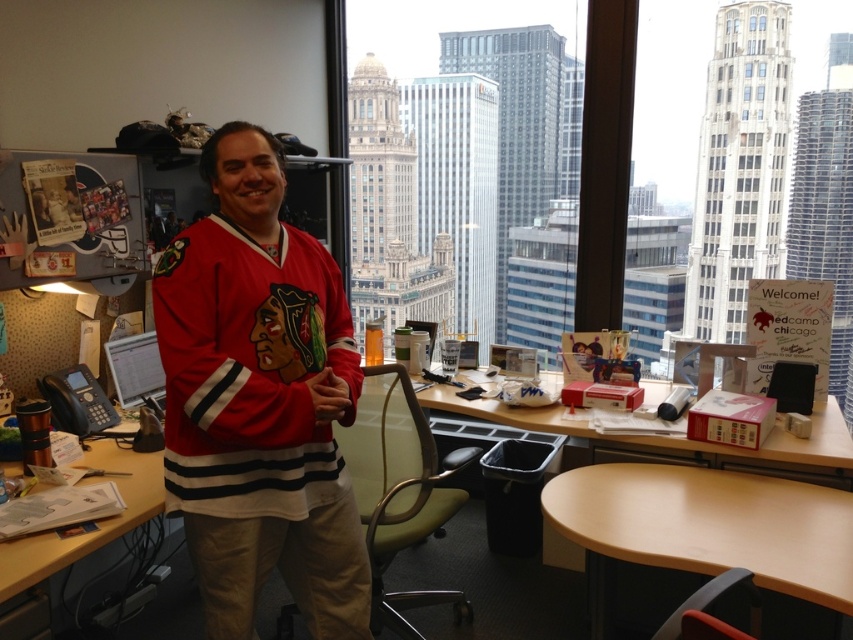
Question: Based on their relative distances, which object is farther from the wooden desk at center?

Choices:
 (A) matte jersey at center
 (B) light brown wood table at lower right

Answer: (A)

Question: Observing the image, what is the correct spatial positioning of matte jersey at center in reference to light brown wood table at lower right?

Choices:
 (A) right
 (B) left

Answer: (B)

Question: Which is nearer to the matte jersey at center?

Choices:
 (A) wooden desk at center
 (B) wooden desk at lower left

Answer: (B)

Question: Can you confirm if matte jersey at center is smaller than wooden desk at center?

Choices:
 (A) yes
 (B) no

Answer: (A)

Question: Which point is closer to the camera?

Choices:
 (A) (256, 509)
 (B) (660, 442)
 (C) (776, 536)

Answer: (A)

Question: Is matte jersey at center above wooden desk at center?

Choices:
 (A) no
 (B) yes

Answer: (B)